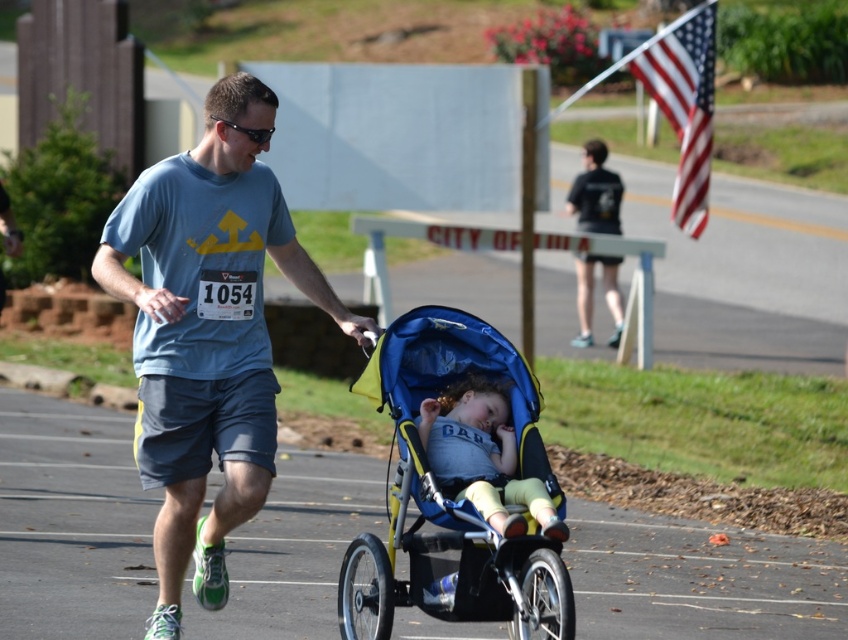
Between point (381, 356) and point (472, 392), which one is positioned behind?

Point (472, 392)

Describe the element at coordinates (450, 496) in the screenshot. Image resolution: width=848 pixels, height=640 pixels. I see `blue/yellow fabric stroller at center` at that location.

Between point (516, 422) and point (540, 531), which one is positioned behind?

The point (516, 422) is more distant.

Identify the location of blue/yellow fabric stroller at center. (450, 496).

Based on the photo, is blue/yellow fabric stroller at center smaller than black matte shirt at upper center?

Incorrect, blue/yellow fabric stroller at center is not smaller in size than black matte shirt at upper center.

Which is in front, point (506, 596) or point (592, 204)?

Point (506, 596) is more forward.

Where is `blue/yellow fabric stroller at center`? blue/yellow fabric stroller at center is located at coordinates (450, 496).

Which is behind, point (247, 328) or point (491, 488)?

Point (247, 328)

What are the coordinates of `blue cotton shirt at center` in the screenshot? It's located at (207, 332).

Which is behind, point (321, 276) or point (449, 433)?

Positioned behind is point (321, 276).

Locate an element on the screen. blue cotton shirt at center is located at coordinates (207, 332).